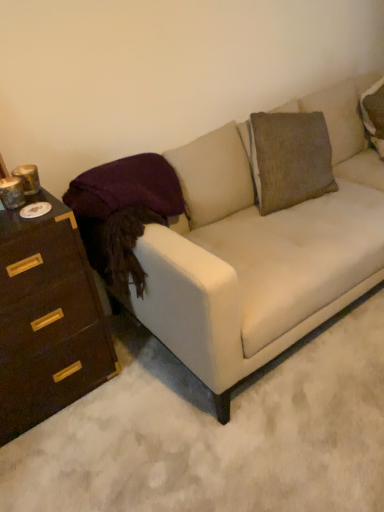
At what (x,y) coordinates should I click in order to perform the action: click on free location to the right of dark brown wood chest of drawers at left. Please return your answer as a coordinate pair (x, y). This screenshot has width=384, height=512. Looking at the image, I should click on (143, 390).